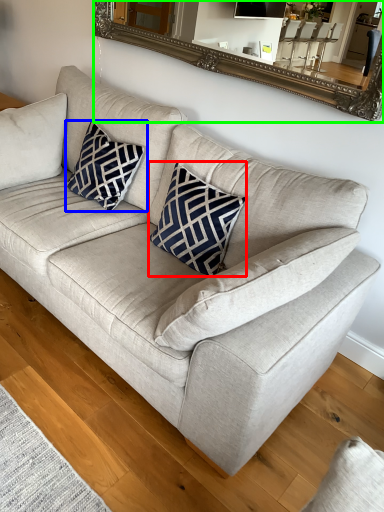
Question: Which object is the closest to the throw pillow (highlighted by a red box)? Choose among these: pillow (highlighted by a blue box) or mirror (highlighted by a green box).

Choices:
 (A) pillow
 (B) mirror

Answer: (A)